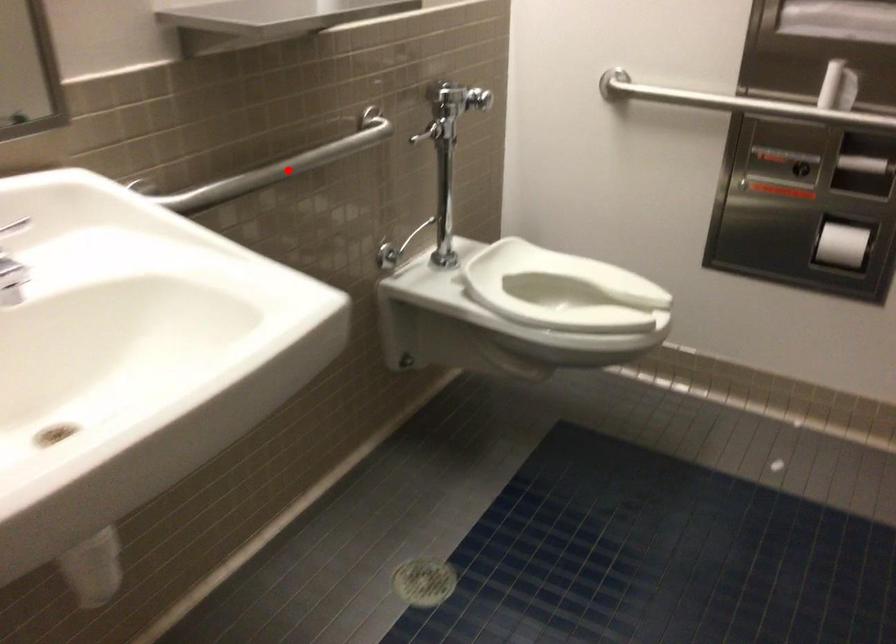
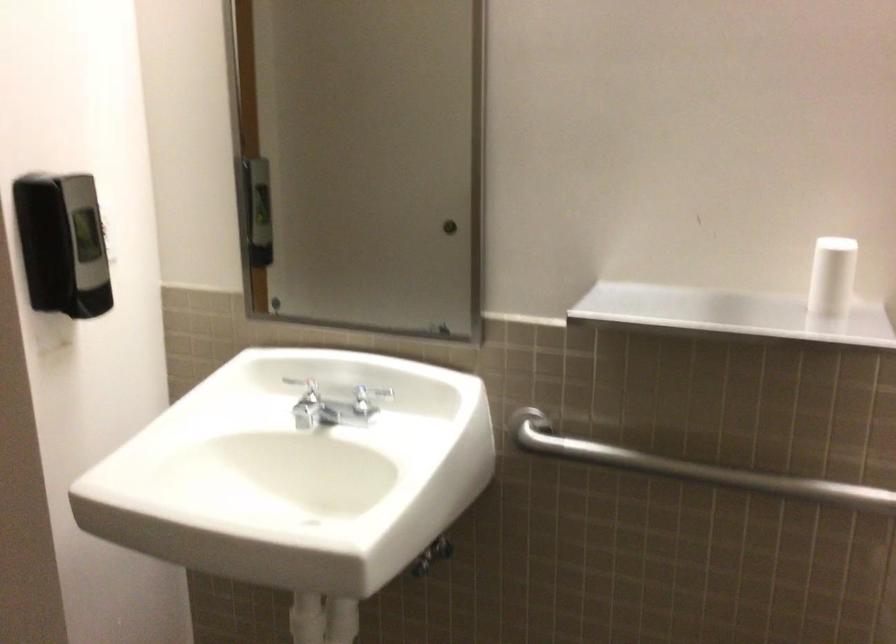
Locate, in the second image, the point that corresponds to the highlighted location in the first image.

(691, 468)